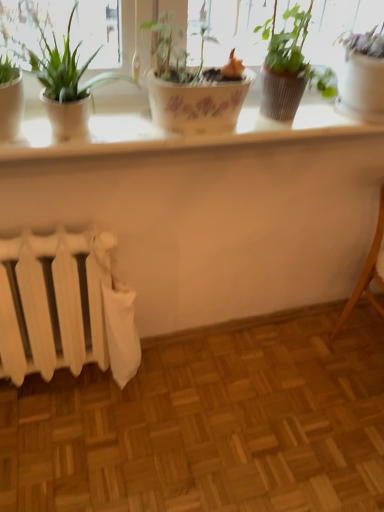
I want to click on free location to the right of white matte radiator at lower left, so click(167, 396).